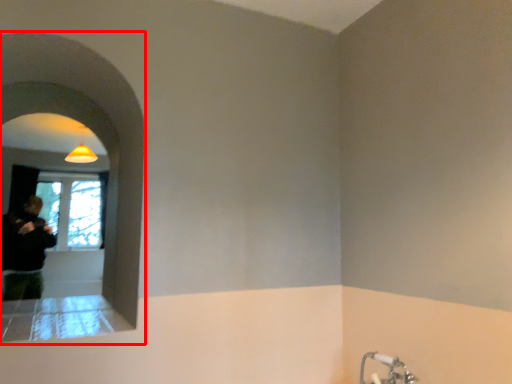
Question: From the image's perspective, what is the correct spatial positioning of archway (annotated by the red box) in reference to tap?

Choices:
 (A) above
 (B) below

Answer: (A)